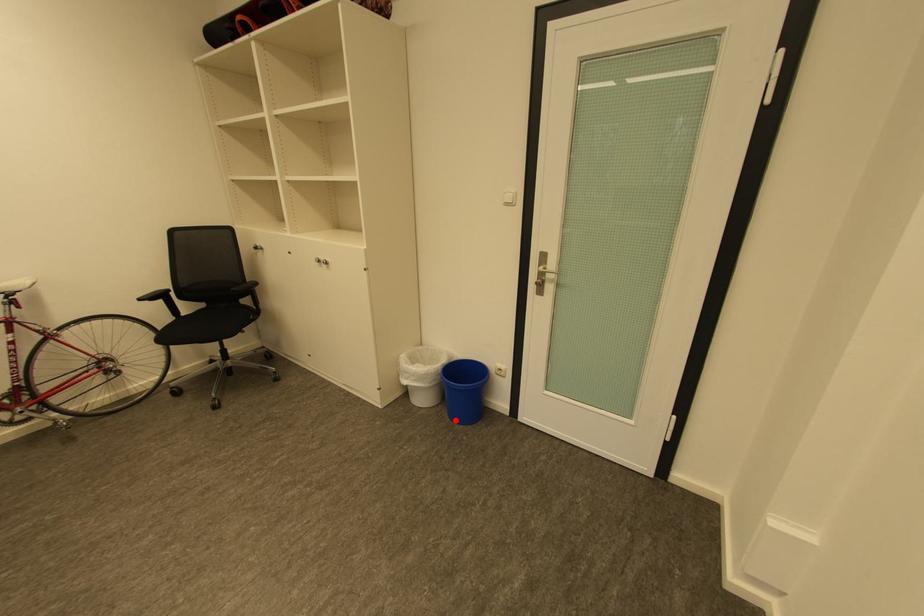
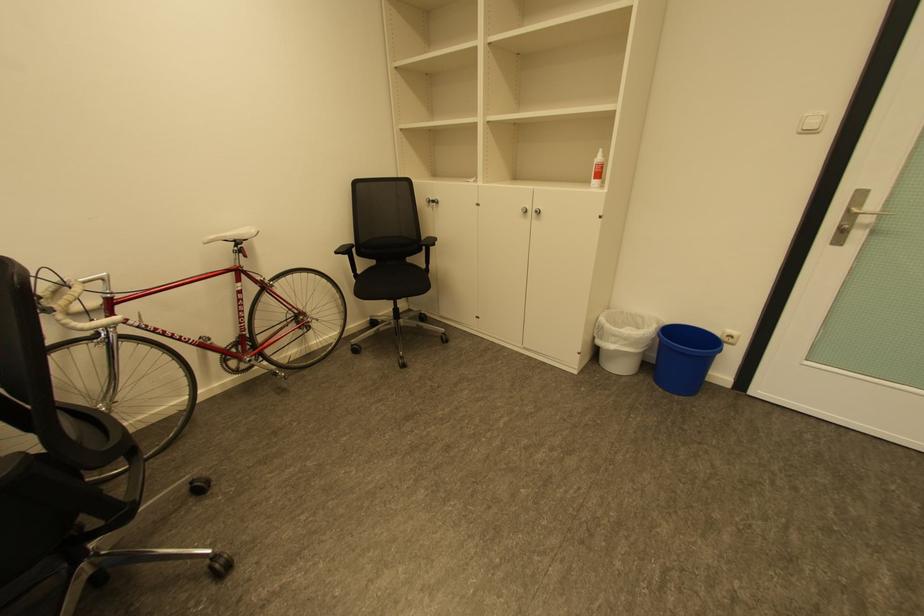
Question: I am providing you with two images of the same scene from different viewpoints. Given a red point in image1, look at the same physical point in image2. Is it:

Choices:
 (A) Closer to the viewpoint
 (B) Farther from the viewpoint

Answer: (A)